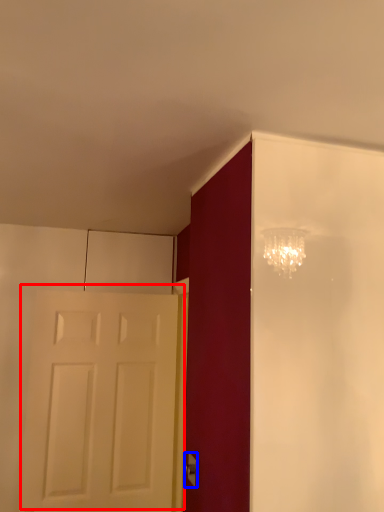
Question: Which object is further to the camera taking this photo, door (highlighted by a red box) or door handle (highlighted by a blue box)?

Choices:
 (A) door
 (B) door handle

Answer: (A)